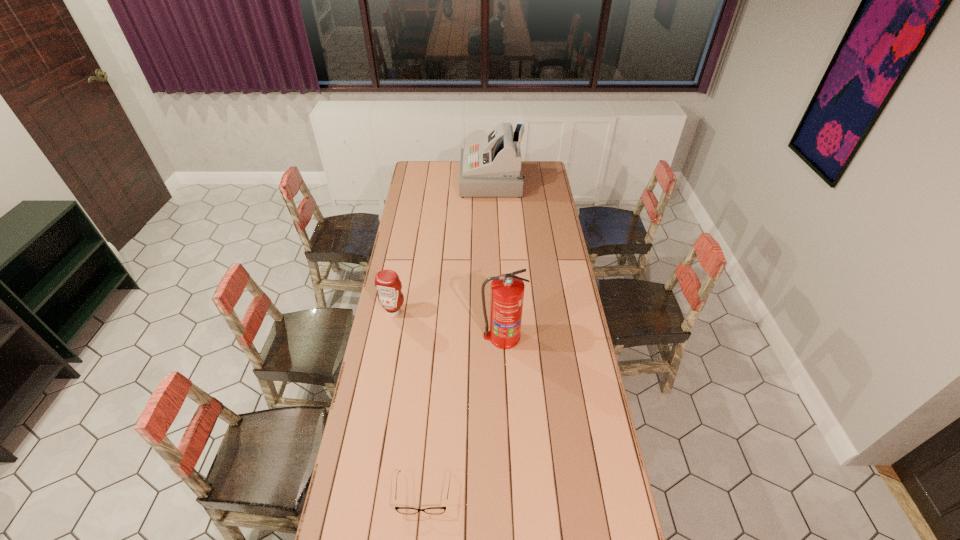
Locate which object is the closest to the third farthest object. Please provide its 2D coordinates. Your answer should be formatted as a tuple, i.e. [(x, y)], where the tuple contains the x and y coordinates of a point satisfying the conditions above.

[(387, 282)]

What are the coordinates of `object identified as the closest to the farthest object` in the screenshot? It's located at (387, 282).

You are a GUI agent. You are given a task and a screenshot of the screen. Output one action in this format:
    pyautogui.click(x=<x>, y=<y>)
    Task: Click on the vacant space that satisfies the following two spatial constraints: 1. on the keypad side of the farthest object; 2. on the front side of the condiment
    The height and width of the screenshot is (540, 960).
    Given the screenshot: What is the action you would take?
    pyautogui.click(x=496, y=312)